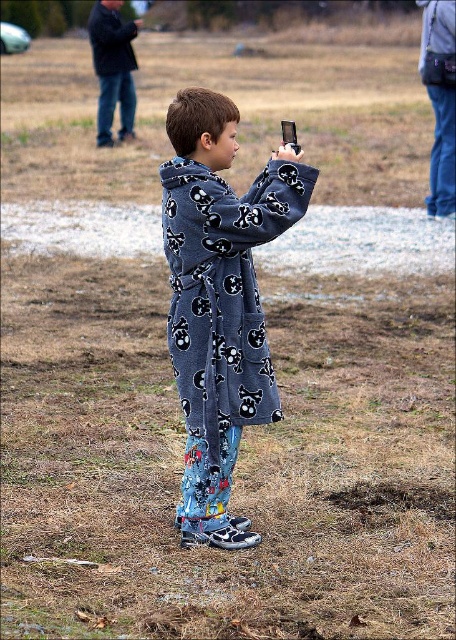
Question: Considering the relative positions of flannel fleece jacket at center and metallic silver phone at upper center in the image provided, where is flannel fleece jacket at center located with respect to metallic silver phone at upper center?

Choices:
 (A) above
 (B) below

Answer: (B)

Question: Which of the following is the farthest from the observer?

Choices:
 (A) (253, 400)
 (B) (281, 134)

Answer: (B)

Question: Among these points, which one is farthest from the camera?

Choices:
 (A) (295, 138)
 (B) (119, 102)

Answer: (B)

Question: Which object is farther from the camera taking this photo?

Choices:
 (A) flannel fleece jacket at center
 (B) metallic silver phone at upper center

Answer: (B)

Question: Does flannel fleece jacket at center have a lesser width compared to dark gray fleece robe at upper left?

Choices:
 (A) no
 (B) yes

Answer: (B)

Question: Can you confirm if dark gray fleece robe at upper left is wider than metallic silver phone at upper center?

Choices:
 (A) no
 (B) yes

Answer: (B)